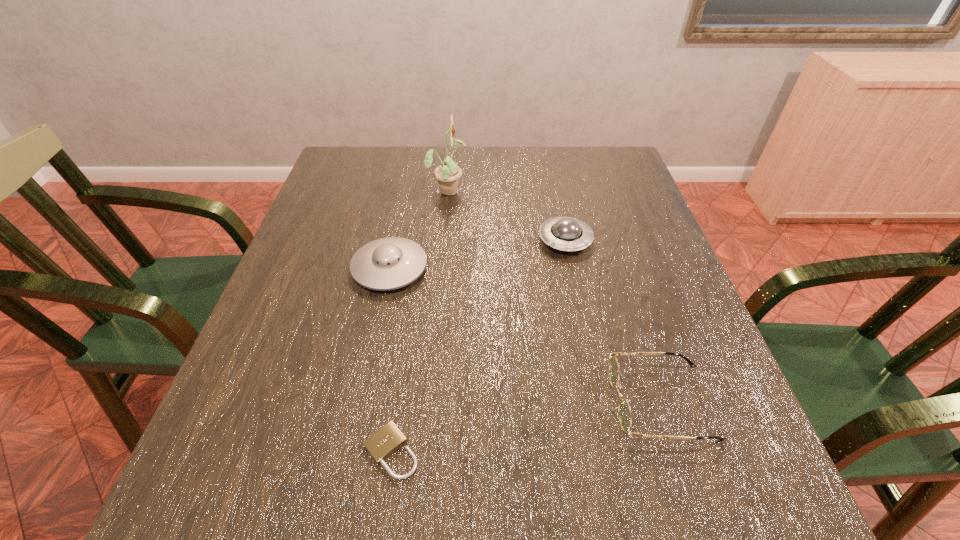
Where is `the farthest object`? Image resolution: width=960 pixels, height=540 pixels. the farthest object is located at coordinates (448, 173).

Locate an element on the screen. the tallest object is located at coordinates [x=448, y=173].

Locate an element on the screen. The width and height of the screenshot is (960, 540). the right saucer is located at coordinates (563, 233).

At what (x,y) coordinates should I click in order to perform the action: click on the left saucer. Please return your answer as a coordinate pair (x, y). This screenshot has width=960, height=540. Looking at the image, I should click on (389, 263).

Find the location of a particular element. This screenshot has width=960, height=540. spectacles is located at coordinates (624, 412).

Image resolution: width=960 pixels, height=540 pixels. Find the location of `the shortest object`. the shortest object is located at coordinates (383, 443).

In order to click on vacant space located 0.100m on the front-facing side of the sunflower in this screenshot , I will do `click(502, 190)`.

I want to click on vacant region located 0.360m on the left of the right saucer, so click(x=390, y=240).

Where is `vacant space located 0.110m on the left of the left saucer`? The image size is (960, 540). vacant space located 0.110m on the left of the left saucer is located at coordinates (304, 268).

Image resolution: width=960 pixels, height=540 pixels. In order to click on vacant space positioned on the lenses of the spectacles in this screenshot , I will do `click(578, 401)`.